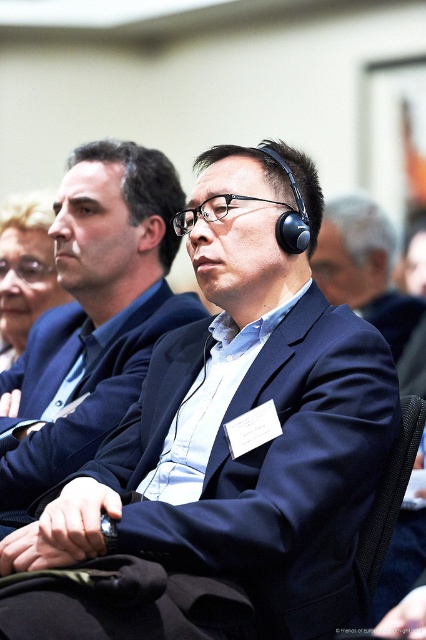
You are organizing a photo shoot and need to arrange the navy blue fabric business suit at center and the matte black suit at left in a way that follows the original image setup. Which suit should be placed lower to maintain the original composition?

The navy blue fabric business suit at center should be placed lower than the matte black suit at left to maintain the original composition, as it was positioned under the matte black suit at left in the scene.

You are a photographer positioned at the origin point of the coordinate system. You want to take a photo of the scene such that the matte black headphones at center is centered in the frame. What adjustment should you make to your camera to ensure the headphones are at the center?

The 2D location of the matte black headphones at center is at point (363, 268), so you should adjust the camera to move the frame slightly to the right and down to center the headphones at those coordinates.

You are a photographer adjusting your camera settings to focus on two specific points in the image. The first point is at coordinates point [166,445] and the second is at point [20,284]. Which point should you focus on to ensure the closest object is in sharp detail?

Point [166,445] is closer to the camera than point [20,284], so you should focus on point [166,445] to capture the closest object clearly.